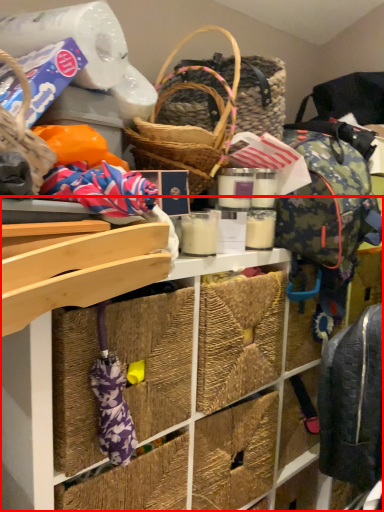
Question: From the image's perspective, where is shelf (annotated by the red box) located in relation to backpack in the image?

Choices:
 (A) above
 (B) below

Answer: (B)